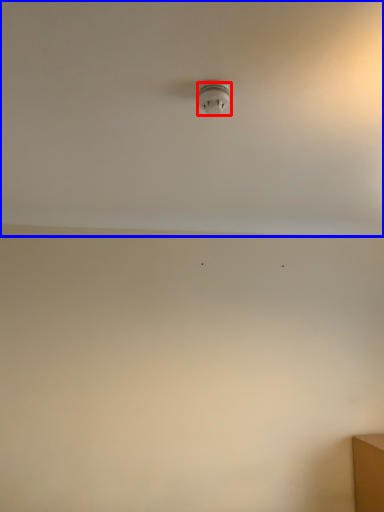
Question: Which object is closer to the camera taking this photo, light fixture (highlighted by a red box) or backdrop (highlighted by a blue box)?

Choices:
 (A) light fixture
 (B) backdrop

Answer: (B)